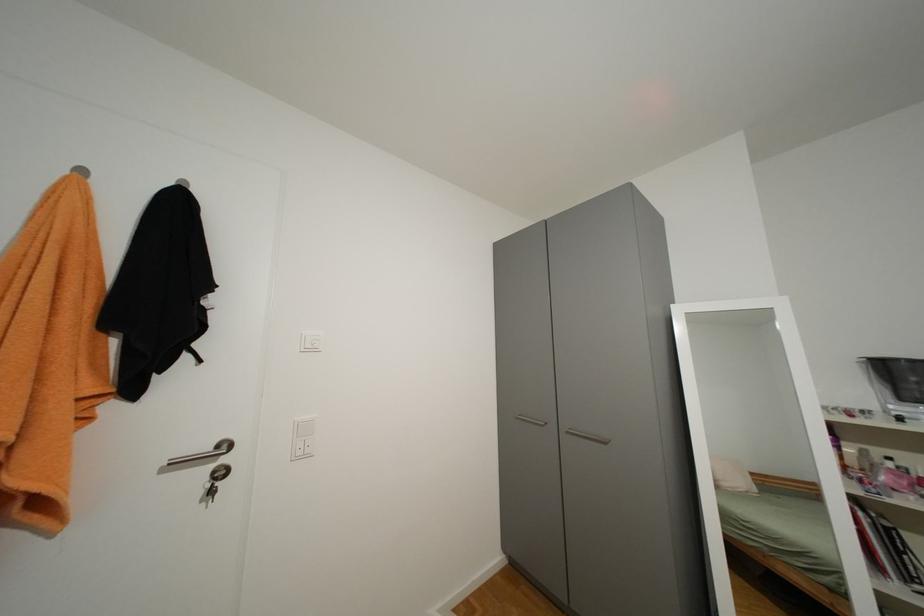
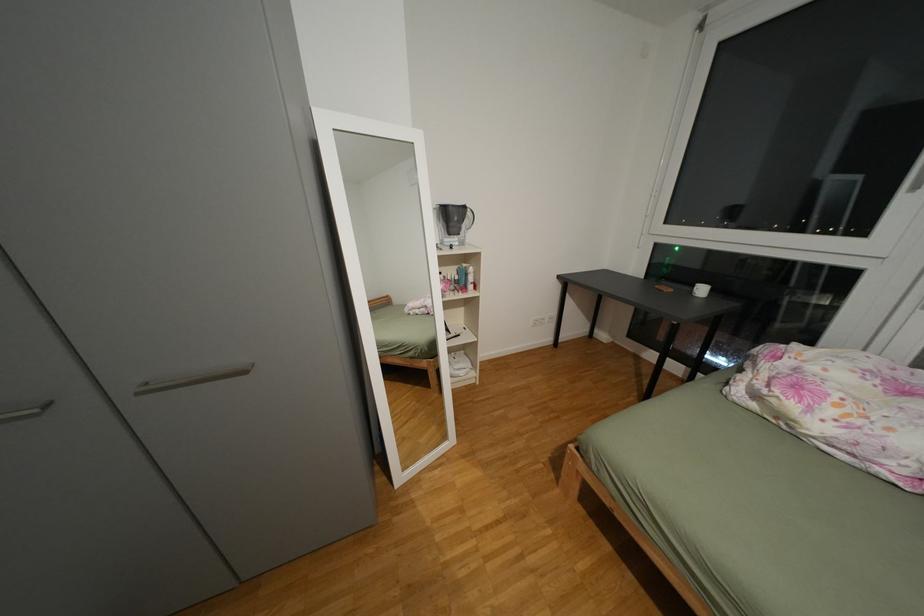
The first image is from the beginning of the video and the second image is from the end. How did the camera likely rotate when shooting the video?

The camera's rotation is toward right-down.